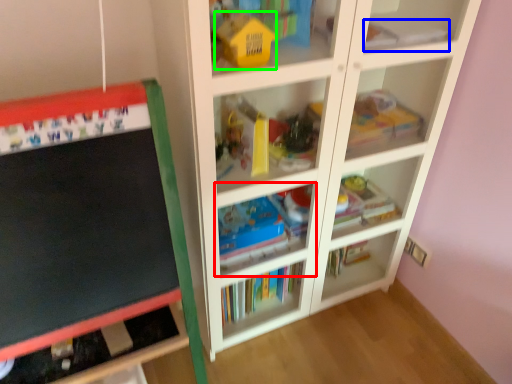
Question: Based on their relative distances, which object is farther from shelf (highlighted by a red box)? Choose from book (highlighted by a blue box) and toy (highlighted by a green box).

Choices:
 (A) book
 (B) toy

Answer: (A)